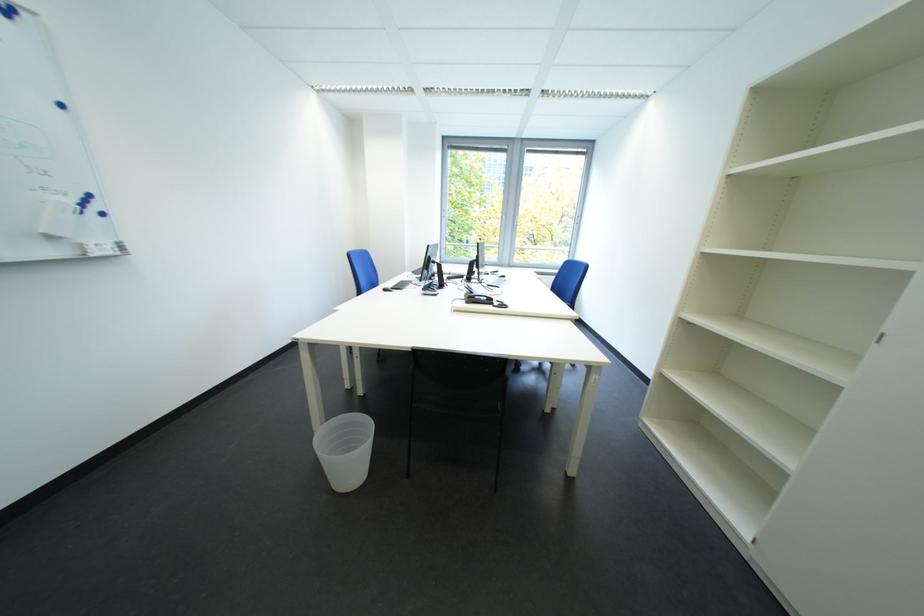
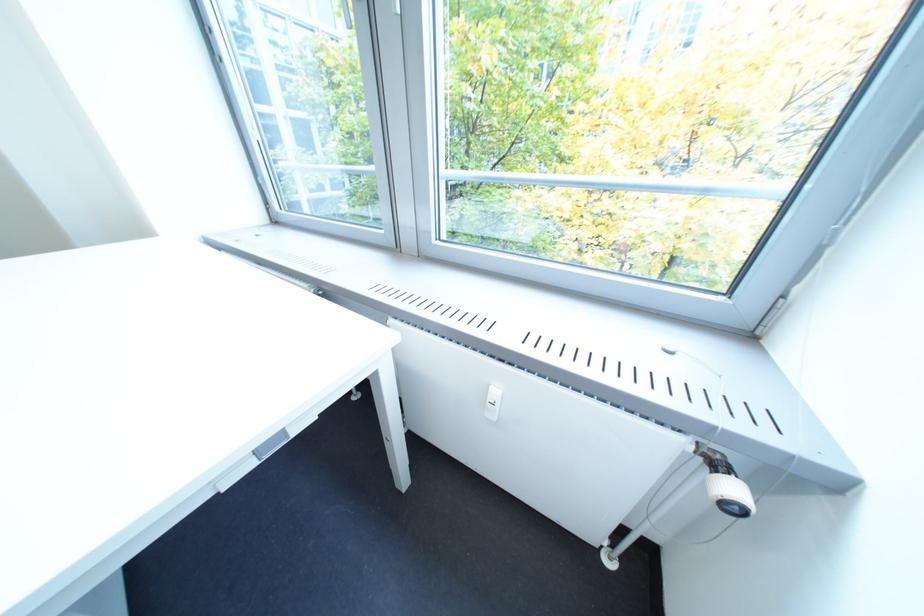
In a continuous first-person perspective shot, in which direction is the camera moving?

The movement direction of the cameraman is right, forward.